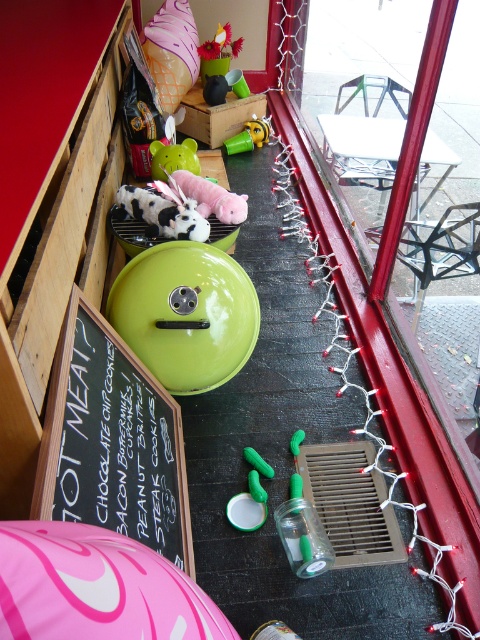
You are setting up a food stall and need to place a sign. You have a clear glass jar at lower left and a green rubber toy at center. Which object should you place your sign next to if you want it to be more noticeable due to its size?

The clear glass jar at lower left is bigger than the green rubber toy at center, so placing the sign next to the clear glass jar at lower left would make it more noticeable due to its larger size.

You are standing in front of the barbecue grill and want to place a new decoration. You have two points marked on the grill surface at coordinates point (206, 352) and point (156, 147). Which point is closer to you if you are facing the grill directly?

Point (206, 352) is closer to the viewer than point (156, 147).